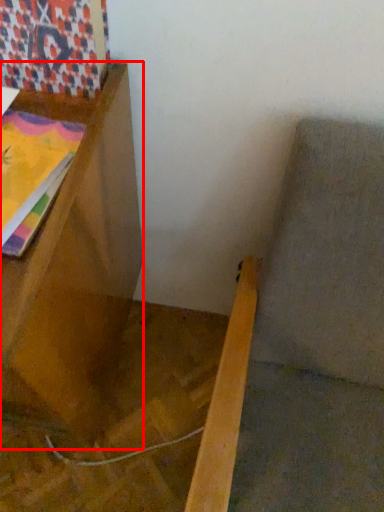
Question: Observing the image, what is the correct spatial positioning of furniture (annotated by the red box) in reference to tapestry?

Choices:
 (A) right
 (B) left

Answer: (B)